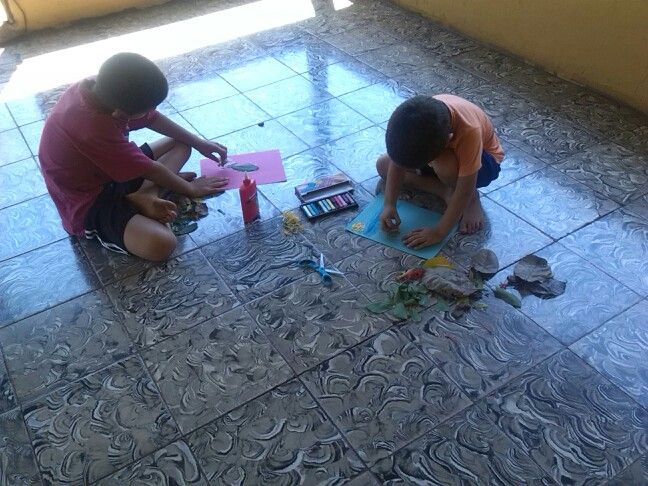
This screenshot has height=486, width=648. I want to click on yellow walls, so click(x=56, y=20), click(x=551, y=44).